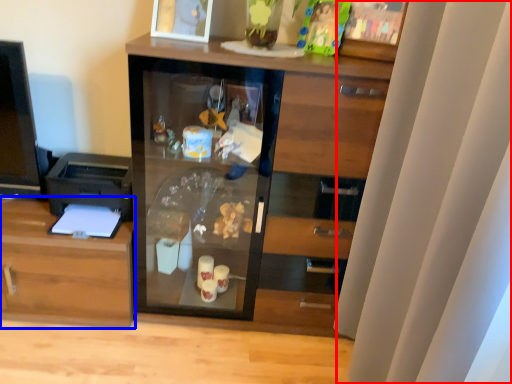
Question: Among these objects, which one is farthest to the camera, curtain (highlighted by a red box) or cabinetry (highlighted by a blue box)?

Choices:
 (A) curtain
 (B) cabinetry

Answer: (B)